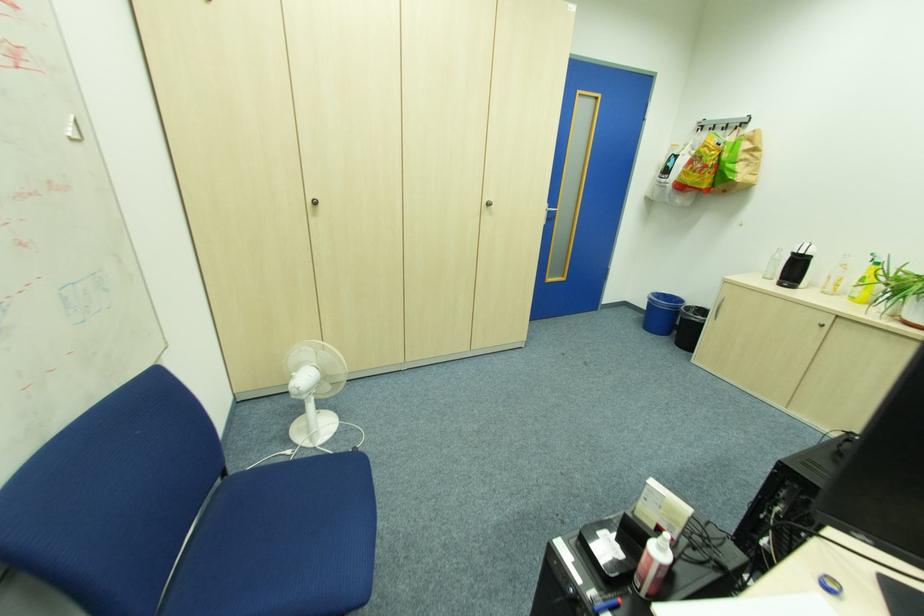
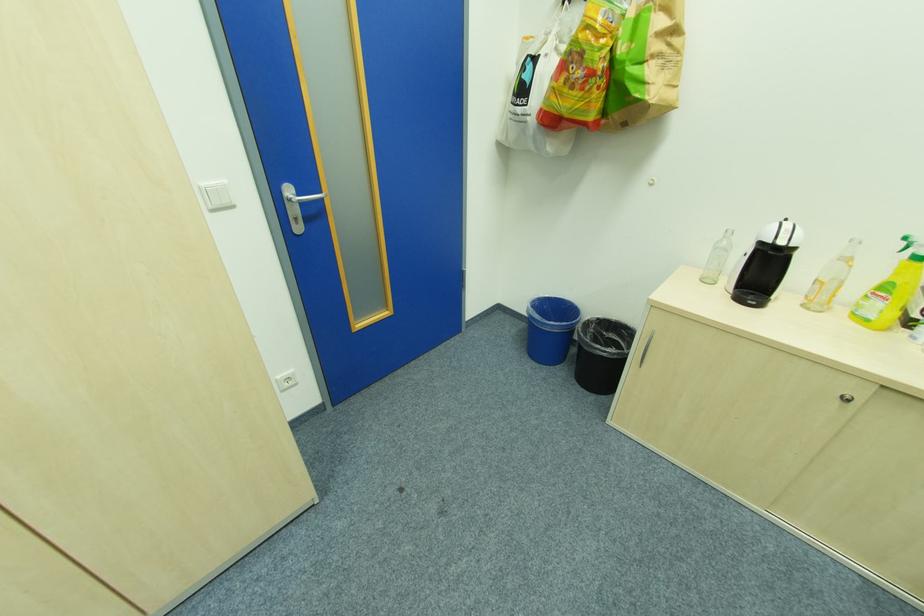
In the second image, find the point that corresponds to pixel 667 294 in the first image.

(552, 297)